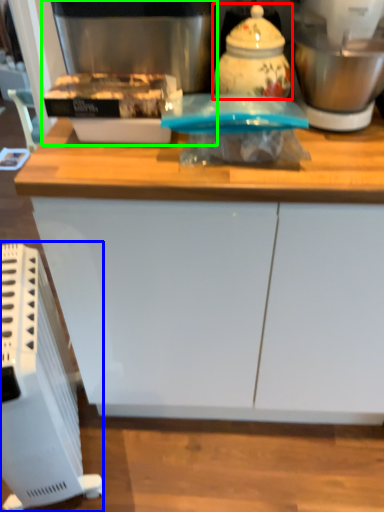
Question: Which is farther away from kitchen appliance (highlighted by a red box)? home appliance (highlighted by a blue box) or coffee machine (highlighted by a green box)?

Choices:
 (A) home appliance
 (B) coffee machine

Answer: (A)